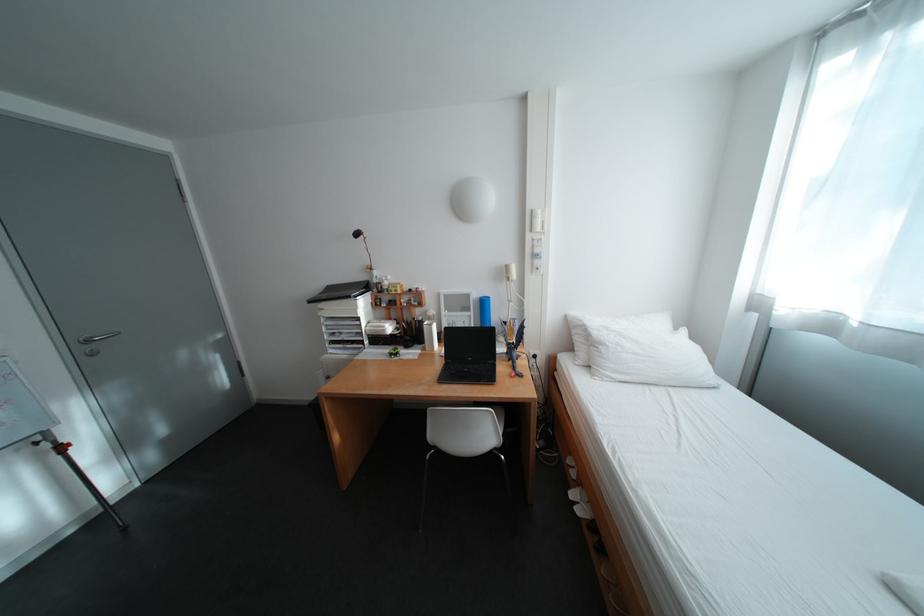
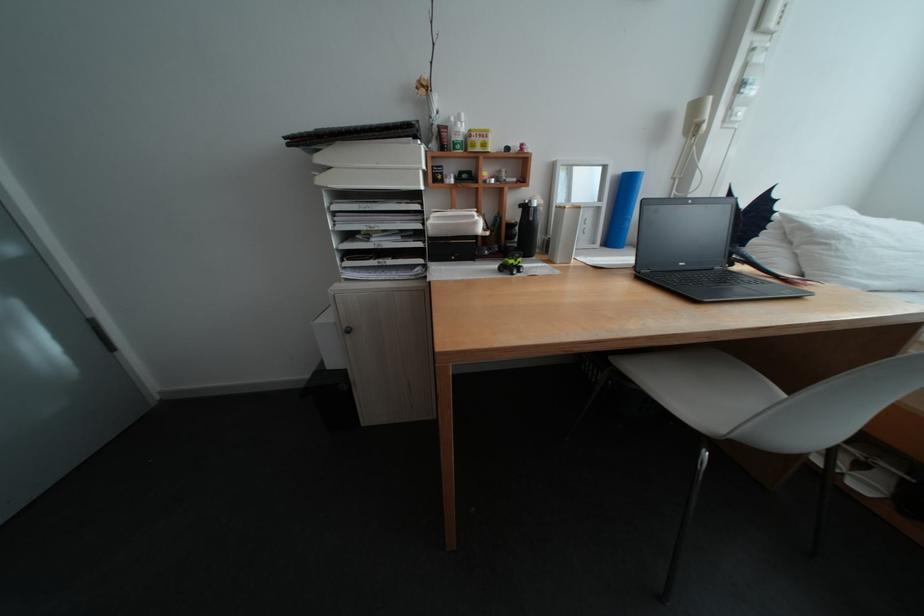
Where in the second image is the point corresponding to (x=403, y=286) from the first image?

(485, 135)